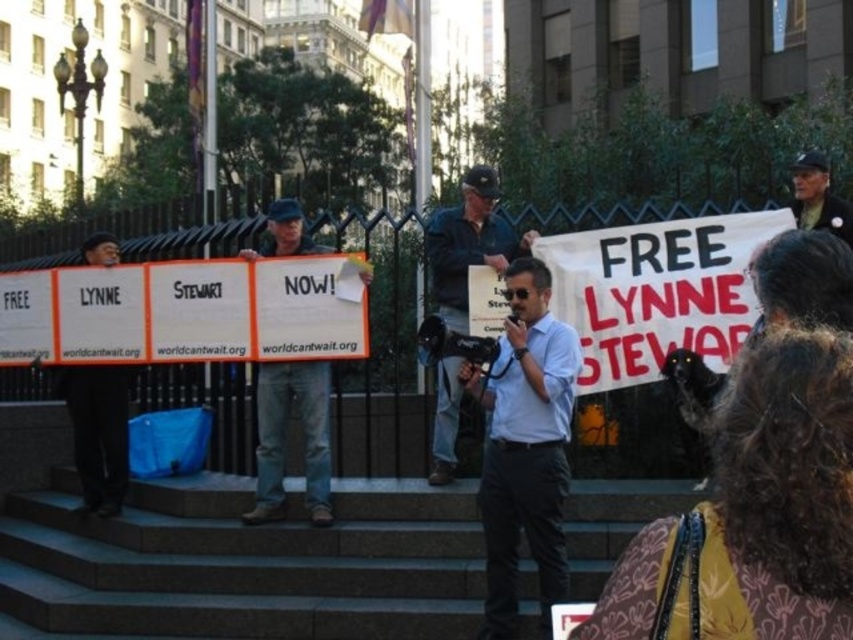
Question: Is gray stone stairs at center to the left of dark blue uniform at upper right from the viewer's perspective?

Choices:
 (A) yes
 (B) no

Answer: (A)

Question: Is light blue shirt at center below blue denim jeans at center?

Choices:
 (A) no
 (B) yes

Answer: (B)

Question: Which point is farther to the camera?

Choices:
 (A) (450, 410)
 (B) (799, 177)
 (C) (503, 611)
 (D) (345, 566)

Answer: (B)

Question: Which point is farther to the camera?

Choices:
 (A) dark blue uniform at upper right
 (B) light blue shirt at center
 (C) gray stone stairs at center

Answer: (A)

Question: Among these points, which one is nearest to the camera?

Choices:
 (A) (508, 584)
 (B) (138, 534)
 (C) (474, 208)

Answer: (A)

Question: Does gray stone stairs at center appear on the left side of blue denim jeans at center?

Choices:
 (A) no
 (B) yes

Answer: (B)